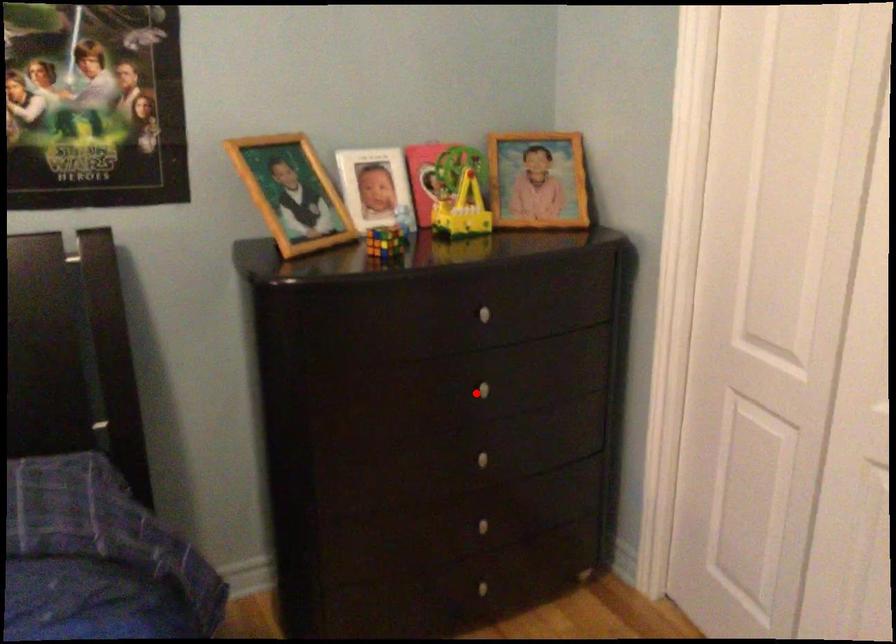
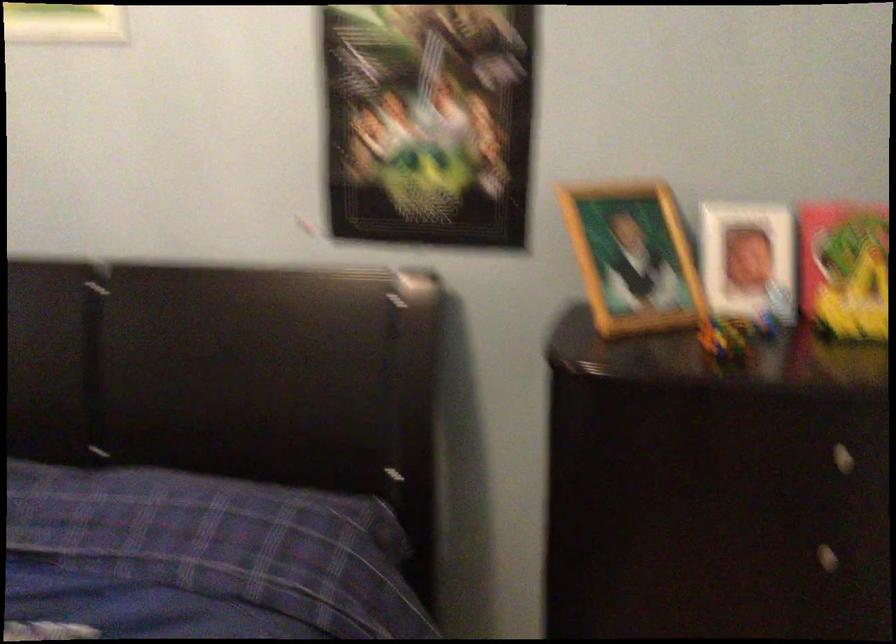
Question: I am providing you with two images of the same scene from different viewpoints. In image1, a red point is highlighted. Considering the same 3D point in image2, which of the following is correct?

Choices:
 (A) It is closer
 (B) It is farther

Answer: (A)